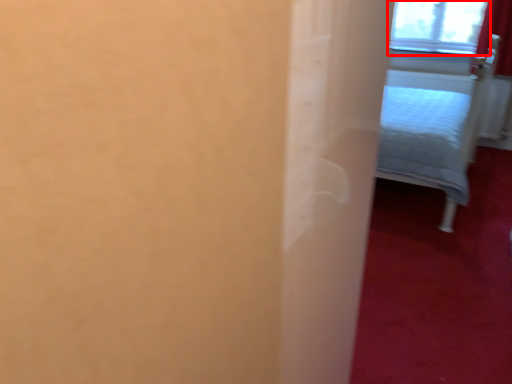
Question: From the image, what is the correct spatial relationship of window (annotated by the red box) in relation to furniture?

Choices:
 (A) left
 (B) right

Answer: (B)